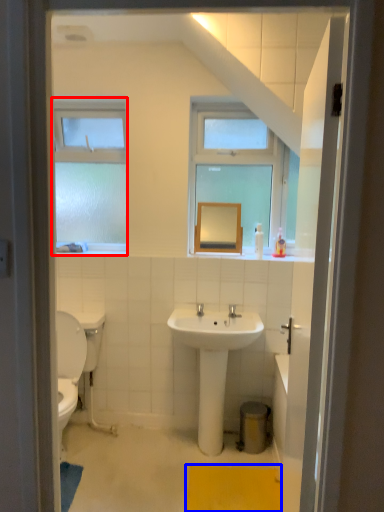
Question: Among these objects, which one is nearest to the camera, window (highlighted by a red box) or bath mat (highlighted by a blue box)?

Choices:
 (A) window
 (B) bath mat

Answer: (B)